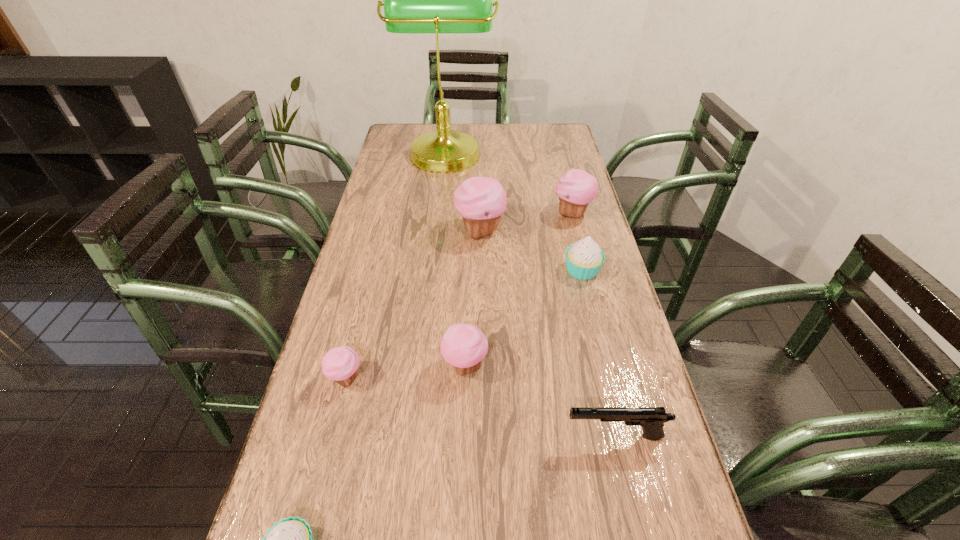
Identify the location of vacant space positioned on the back of the smallest pink cupcake. (364, 309).

What are the coordinates of `object positioned at the far edge` in the screenshot? It's located at (436, 0).

Find the location of a particular element. The image size is (960, 540). lamp positioned at the left edge is located at coordinates (436, 0).

Identify the location of cupcake situated at the left edge. The height and width of the screenshot is (540, 960). (340, 364).

Find the location of a particular element. Image resolution: width=960 pixels, height=540 pixels. gun present at the right edge is located at coordinates (652, 419).

This screenshot has width=960, height=540. I want to click on object at the far left corner, so click(436, 0).

This screenshot has height=540, width=960. Find the location of `free space at the far edge of the desktop`. free space at the far edge of the desktop is located at coordinates (484, 144).

The width and height of the screenshot is (960, 540). What are the coordinates of `free space at the left edge of the desktop` in the screenshot? It's located at (x=317, y=369).

At what (x,y) coordinates should I click in order to perform the action: click on free location at the right edge. Please return your answer as a coordinate pair (x, y). Looking at the image, I should click on (607, 310).

The image size is (960, 540). What are the coordinates of `blank space at the far right corner of the desktop` in the screenshot? It's located at (567, 129).